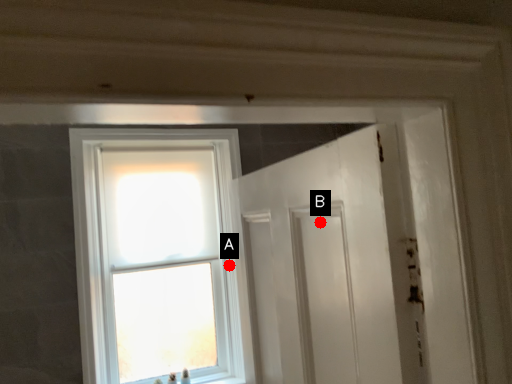
Question: Two points are circled on the image, labeled by A and B beside each circle. Which point is further to the camera?

Choices:
 (A) A is further
 (B) B is further

Answer: (A)